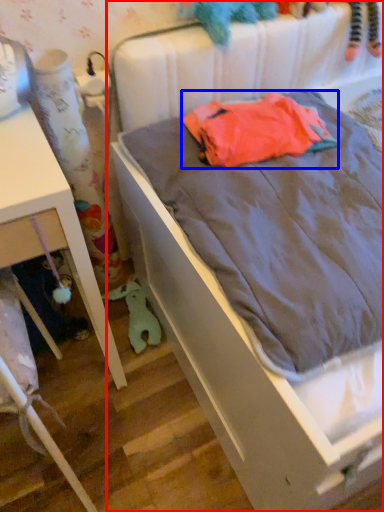
Question: Which object appears closest to the camera in this image, bed (highlighted by a red box) or baby clothe (highlighted by a blue box)?

Choices:
 (A) bed
 (B) baby clothe

Answer: (A)